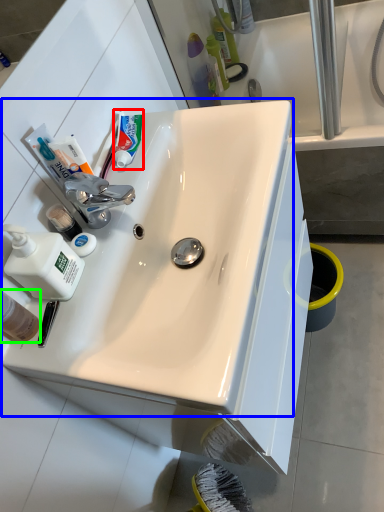
Question: Which object is the farthest from toothpaste (highlighted by a red box)? Choose among these: sink (highlighted by a blue box) or mouthwash (highlighted by a green box).

Choices:
 (A) sink
 (B) mouthwash

Answer: (B)